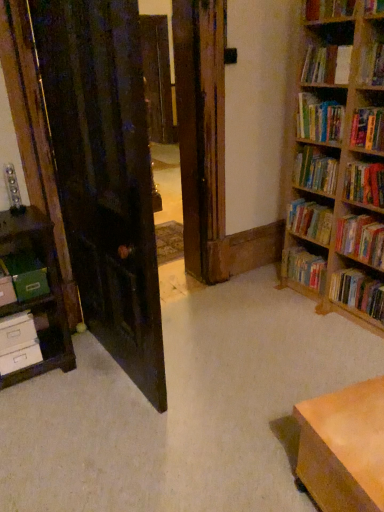
Question: From the image's perspective, is hardcover book at upper right, positioned as the second book in top-to-bottom order, above or below hardcover book at lower right, the 2th book ordered from the bottom?

Choices:
 (A) above
 (B) below

Answer: (A)

Question: Considering the relative positions of hardcover book at upper right, the 8th book when ordered from bottom to top, and hardcover book at lower right, the 2th book ordered from the bottom, in the image provided, is hardcover book at upper right, the 8th book when ordered from bottom to top, to the left or to the right of hardcover book at lower right, the 2th book ordered from the bottom,?

Choices:
 (A) left
 (B) right

Answer: (A)

Question: Which of these objects is positioned farthest from the hardcover book at upper right, the 8th book when ordered from bottom to top?

Choices:
 (A) hardcover book at upper right, which is the 9th book from bottom to top
 (B) hardcover book at right, the seventh book positioned from the top
 (C) hardcover book at upper right, which is the 5th book in bottom-to-top order
 (D) hardcover book at lower right, the 2th book ordered from the bottom
 (E) wooden table at lower right

Answer: (E)

Question: Which object is positioned farthest from the white cardboard drawer at lower left, the second drawer when ordered from bottom to top?

Choices:
 (A) wooden table at lower right
 (B) hardcover books at right, which ranks as the 4th book in bottom-to-top order
 (C) green matte paper at left
 (D) hardcover books at upper right, acting as the seventh book starting from the bottom
 (E) hardcover book at upper right, which is the 9th book from bottom to top

Answer: (E)